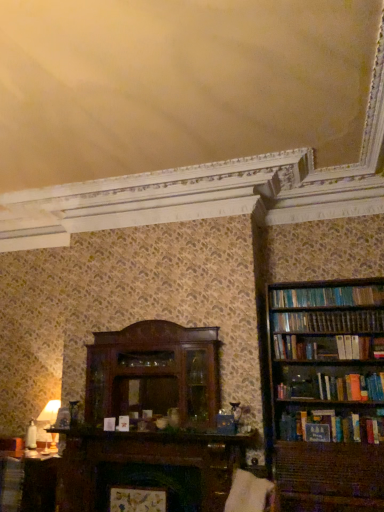
Question: Does matte brown book at lower left lie in front of wooden bookshelf at right?

Choices:
 (A) no
 (B) yes

Answer: (A)

Question: Is matte brown book at lower left further to camera compared to wooden bookshelf at right?

Choices:
 (A) no
 (B) yes

Answer: (B)

Question: Is matte brown book at lower left smaller than wooden bookshelf at right?

Choices:
 (A) yes
 (B) no

Answer: (A)

Question: Considering the relative sizes of matte brown book at lower left and wooden bookshelf at right in the image provided, is matte brown book at lower left wider than wooden bookshelf at right?

Choices:
 (A) no
 (B) yes

Answer: (A)

Question: Is matte brown book at lower left not within wooden bookshelf at right?

Choices:
 (A) no
 (B) yes

Answer: (B)

Question: Would you say matte brown book at lower left contains wooden bookshelf at right?

Choices:
 (A) no
 (B) yes

Answer: (A)

Question: Is matte white table lamp at left facing towards white fabric swivel chair at lower center?

Choices:
 (A) yes
 (B) no

Answer: (B)

Question: Considering the relative sizes of matte white table lamp at left and white fabric swivel chair at lower center in the image provided, is matte white table lamp at left bigger than white fabric swivel chair at lower center?

Choices:
 (A) yes
 (B) no

Answer: (B)

Question: Can you confirm if matte white table lamp at left is shorter than white fabric swivel chair at lower center?

Choices:
 (A) yes
 (B) no

Answer: (B)

Question: Can white fabric swivel chair at lower center be found inside matte white table lamp at left?

Choices:
 (A) yes
 (B) no

Answer: (B)

Question: Does matte white table lamp at left have a greater height compared to white fabric swivel chair at lower center?

Choices:
 (A) yes
 (B) no

Answer: (A)

Question: From a real-world perspective, is matte white table lamp at left on top of white fabric swivel chair at lower center?

Choices:
 (A) yes
 (B) no

Answer: (A)

Question: From the image's perspective, is matte brown book at lower left beneath matte white table lamp at left?

Choices:
 (A) yes
 (B) no

Answer: (A)